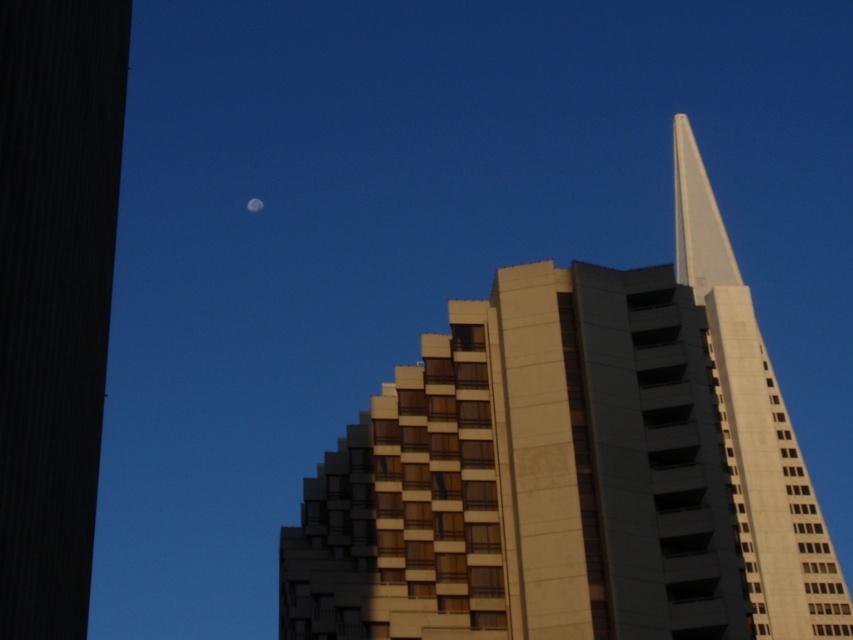
Question: Is beige concrete building at center thinner than silvery reflective moon at upper center?

Choices:
 (A) yes
 (B) no

Answer: (B)

Question: Which object appears farthest from the camera in this image?

Choices:
 (A) white smooth spire at upper right
 (B) silvery reflective moon at upper center
 (C) beige concrete building at center

Answer: (B)

Question: Can you confirm if beige concrete building at center is wider than silvery reflective moon at upper center?

Choices:
 (A) no
 (B) yes

Answer: (B)

Question: Which point appears farthest from the camera in this image?

Choices:
 (A) (260, 205)
 (B) (735, 321)

Answer: (A)

Question: Which point is closer to the camera taking this photo?

Choices:
 (A) (689, 212)
 (B) (254, 209)

Answer: (A)

Question: Can you confirm if white smooth spire at upper right is positioned below silvery reflective moon at upper center?

Choices:
 (A) no
 (B) yes

Answer: (B)